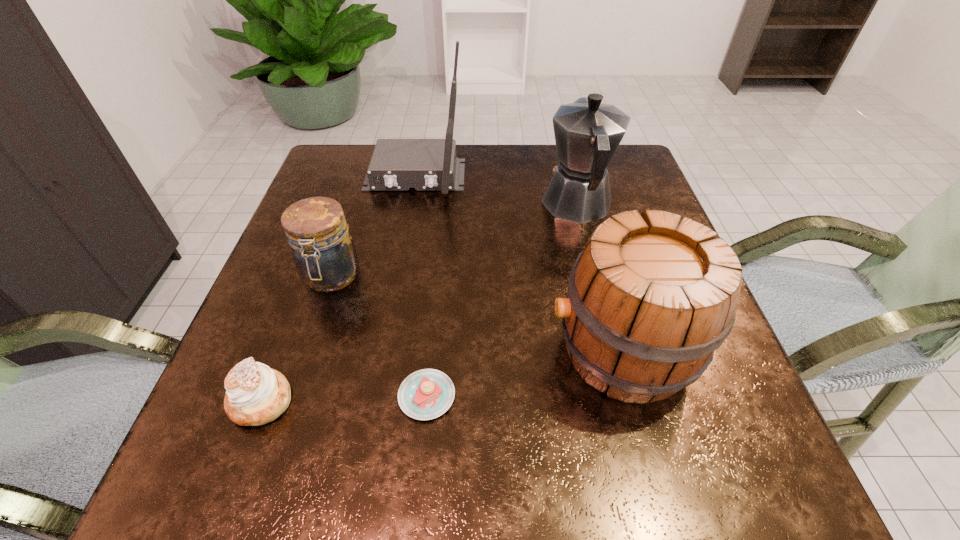
The height and width of the screenshot is (540, 960). I want to click on free point between the cider and the router, so click(518, 263).

Locate an element on the screen. free spot between the shorter pastry and the coffeepot is located at coordinates (502, 300).

You are a GUI agent. You are given a task and a screenshot of the screen. Output one action in this format:
    pyautogui.click(x=<x>, y=<y>)
    Task: Click on the free space between the shorter pastry and the coffeepot
    The width and height of the screenshot is (960, 540).
    Given the screenshot: What is the action you would take?
    tap(502, 300)

I want to click on free space between the shorter pastry and the taller pastry, so click(x=344, y=398).

Where is `vacant space in between the coffeepot and the shorter pastry`? This screenshot has width=960, height=540. vacant space in between the coffeepot and the shorter pastry is located at coordinates (502, 300).

Locate an element on the screen. This screenshot has width=960, height=540. vacant area that lies between the router and the right pastry is located at coordinates (421, 285).

The width and height of the screenshot is (960, 540). I want to click on vacant area between the second shortest object and the coffeepot, so click(420, 303).

Locate which object ranks fifth in proximity to the jar. Please provide its 2D coordinates. Your answer should be formatted as a tuple, i.e. [(x, y)], where the tuple contains the x and y coordinates of a point satisfying the conditions above.

[(587, 132)]

Locate an element on the screen. The width and height of the screenshot is (960, 540). object that is the nearest to the fifth tallest object is located at coordinates pyautogui.click(x=324, y=253).

Where is `vacant region that satisfies the following two spatial constraints: 1. on the back of the shortest object to connect cables; 2. on the right side of the router`? vacant region that satisfies the following two spatial constraints: 1. on the back of the shortest object to connect cables; 2. on the right side of the router is located at coordinates (375, 396).